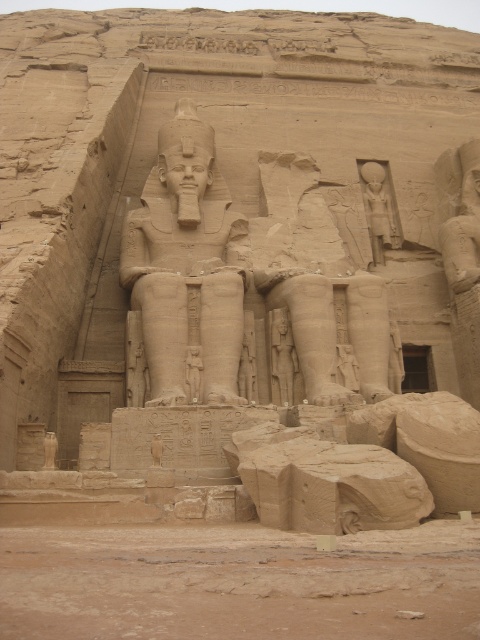
Consider the image. Which is more to the left, sandstone statue at center or smooth stone statue at upper right?

sandstone statue at center is more to the left.

Which is behind, point (179, 246) or point (381, 164)?

Point (381, 164)

The width and height of the screenshot is (480, 640). In order to click on sandstone statue at center in this screenshot , I will do `click(187, 268)`.

Can you confirm if smooth stone statue at upper right is wider than smooth stone statue at center?

Yes, smooth stone statue at upper right is wider than smooth stone statue at center.

Who is higher up, smooth stone statue at upper right or smooth stone statue at center?

smooth stone statue at upper right

Is point (375, 173) positioned after point (280, 314)?

That is True.

The height and width of the screenshot is (640, 480). In order to click on smooth stone statue at upper right in this screenshot , I will do `click(379, 209)`.

Is sandstone statue at center behind smooth stone statue at center?

No, it is in front of smooth stone statue at center.

Describe the element at coordinates (187, 268) in the screenshot. I see `sandstone statue at center` at that location.

This screenshot has width=480, height=640. Identify the location of sandstone statue at center. (187, 268).